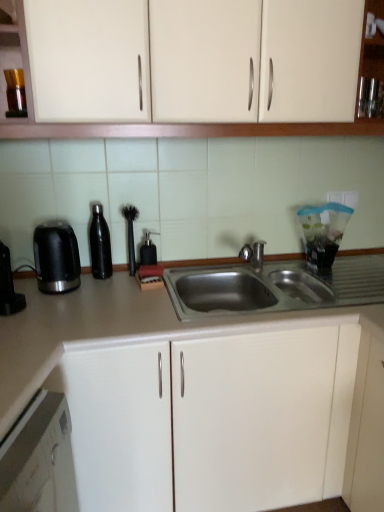
Identify the location of vacant space in between black plastic kettle at left and black plastic coffee machine at left. (41, 301).